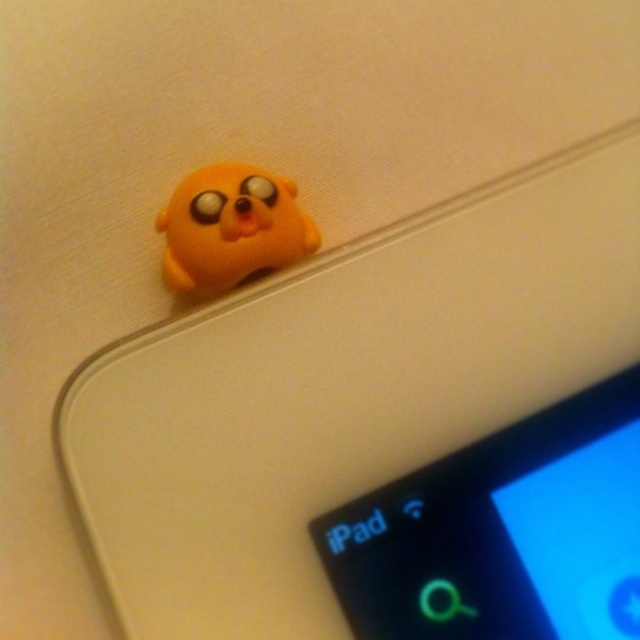
Measure the distance between matte black ipad at upper left and camera.

A distance of 1.03 meters exists between matte black ipad at upper left and camera.

In the scene shown: Is matte black ipad at upper left thinner than matte yellow toy at upper left?

Incorrect, matte black ipad at upper left's width is not less than matte yellow toy at upper left's.

Is point (413, 524) positioned behind point (230, 244)?

No.

Find the location of `matte black ipad at upper left`. matte black ipad at upper left is located at coordinates (502, 532).